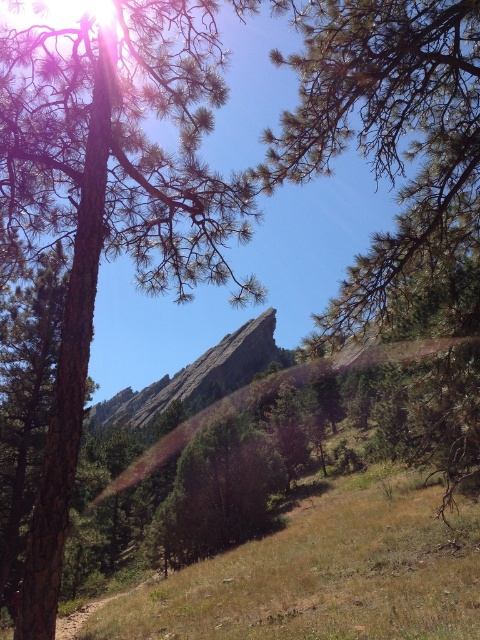
Question: Observing the image, what is the correct spatial positioning of green textured pine tree at center in reference to smooth gray rock at center?

Choices:
 (A) below
 (B) above

Answer: (B)

Question: Which is nearer to the green textured pine tree at center?

Choices:
 (A) brown dry grass at lower center
 (B) green rough bark tree at upper left

Answer: (A)

Question: Does green textured pine tree at center have a smaller size compared to smooth gray rock at center?

Choices:
 (A) no
 (B) yes

Answer: (B)

Question: Which of the following is the farthest from the observer?

Choices:
 (A) (396, 104)
 (B) (214, 355)
 (C) (184, 113)
 (D) (335, 506)

Answer: (B)

Question: From the image, what is the correct spatial relationship of green textured pine tree at center in relation to smooth gray rock at center?

Choices:
 (A) right
 (B) left

Answer: (A)

Question: Which object is the closest to the green textured pine tree at center?

Choices:
 (A) green rough bark tree at upper left
 (B) smooth gray rock at center
 (C) brown dry grass at lower center

Answer: (C)